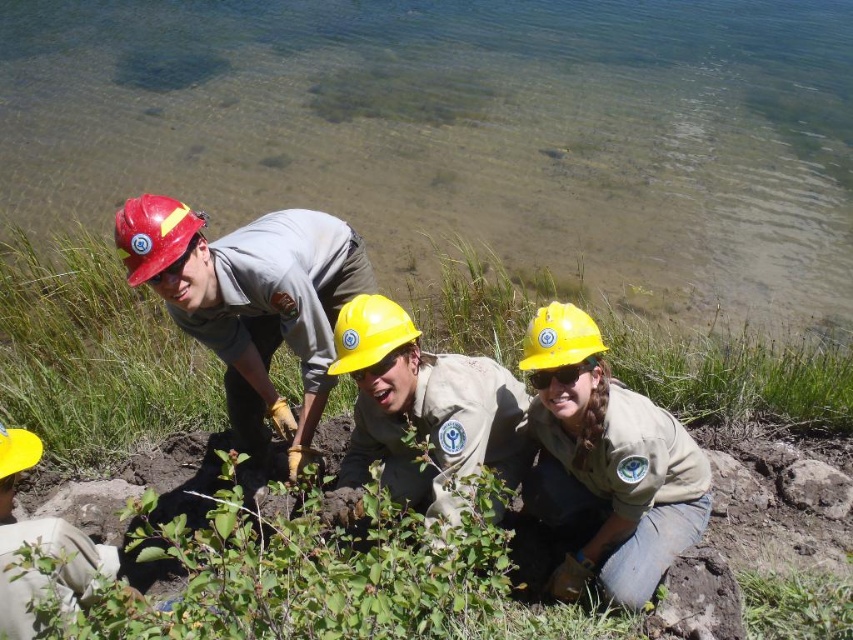
Question: Is yellow matte helmet at center bigger than yellow hard hat at center?

Choices:
 (A) yes
 (B) no

Answer: (A)

Question: Based on their relative distances, which object is nearer to the yellow matte hard hat at center?

Choices:
 (A) yellow matte helmet at lower left
 (B) yellow matte helmet at center

Answer: (B)

Question: Does matte gray uniform at center appear on the left side of yellow matte hard hat at center?

Choices:
 (A) no
 (B) yes

Answer: (B)

Question: Which point is closer to the camera taking this photo?

Choices:
 (A) (498, 419)
 (B) (801, 605)

Answer: (A)

Question: Which object is the closest to the yellow hard hat at center?

Choices:
 (A) yellow matte hard hat at lower center
 (B) green leafy plant at lower right
 (C) matte red hard hat at upper left
 (D) matte gray uniform at center

Answer: (D)

Question: Can you confirm if matte yellow helmet at center is wider than yellow hard hat at center?

Choices:
 (A) no
 (B) yes

Answer: (B)